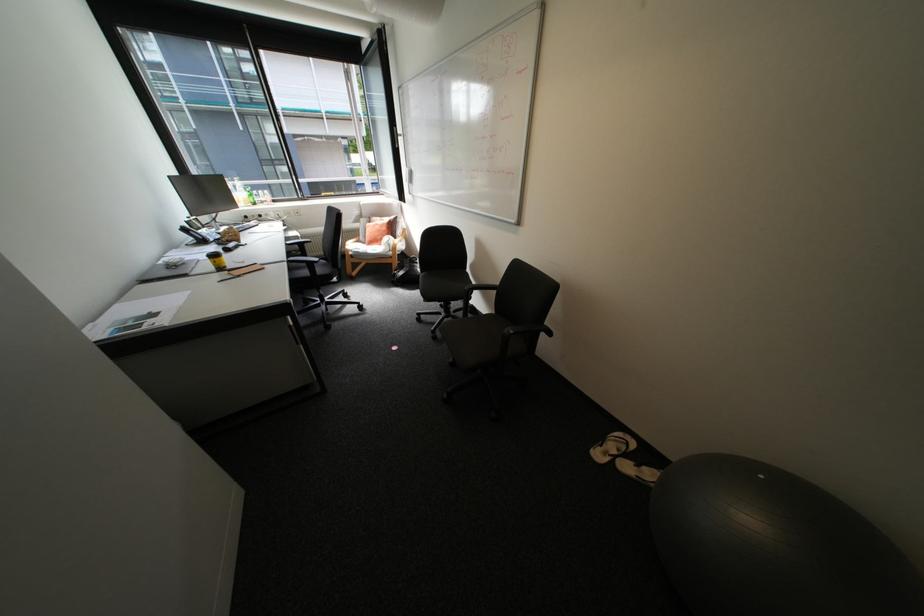
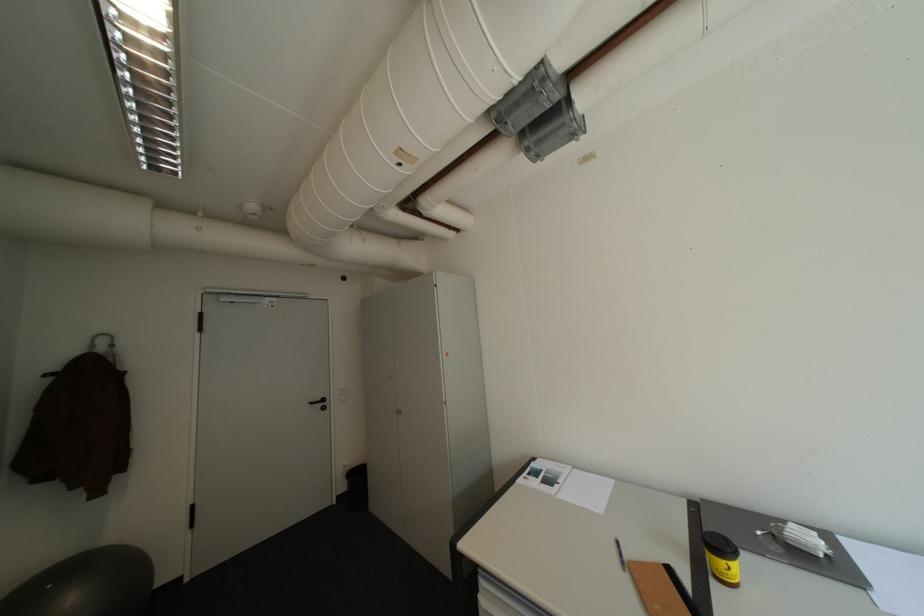
Where in the second image is the point corresponding to (772,477) from the first image?

(59, 586)